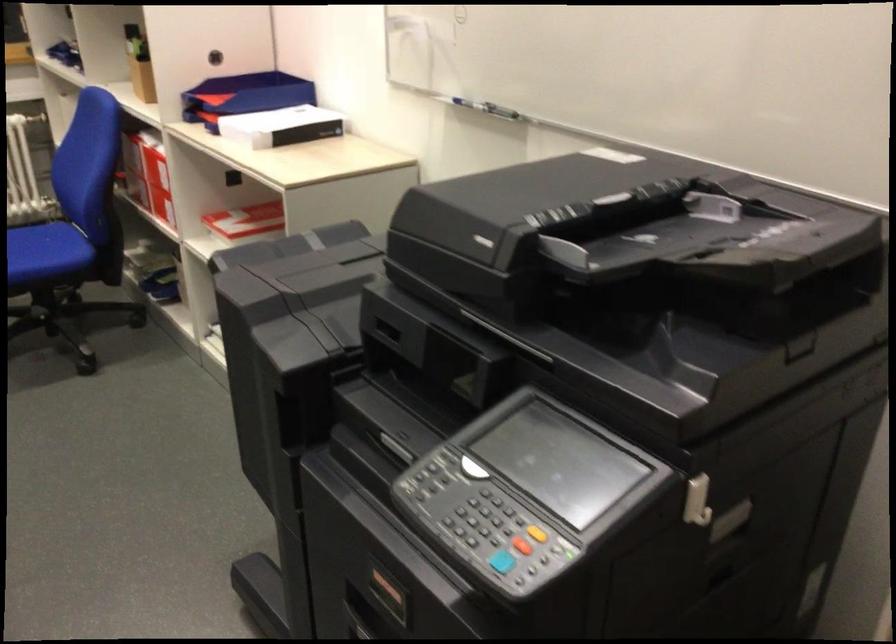
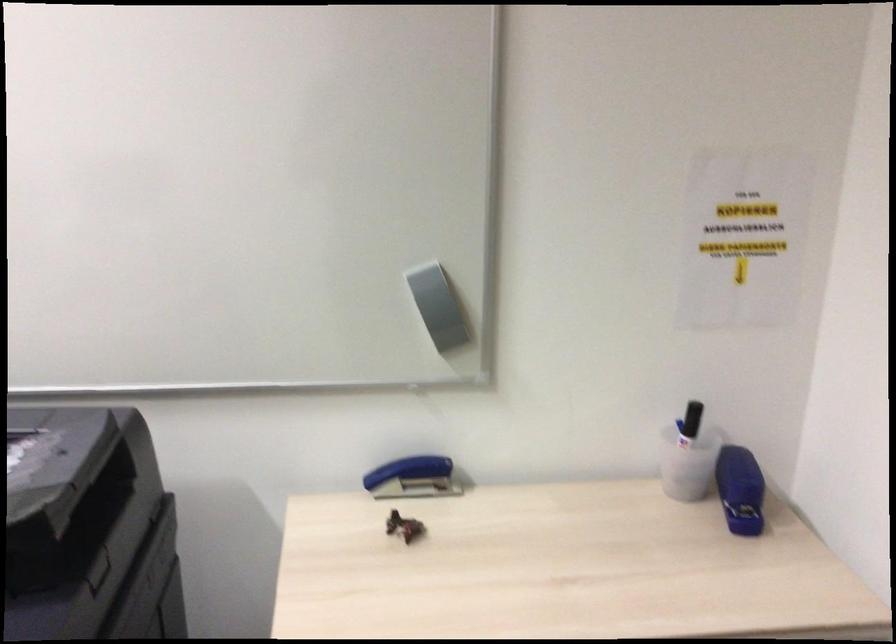
Question: Based on the continuous images, in which direction is the camera rotating? Reply with the corresponding letter.

Choices:
 (A) Left
 (B) Right
 (C) Up
 (D) Down

Answer: (B)